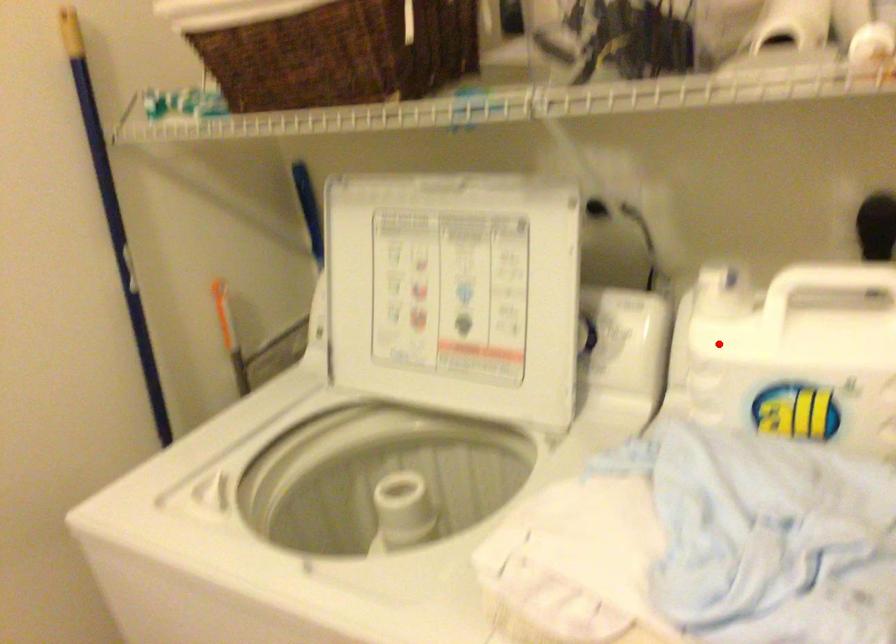
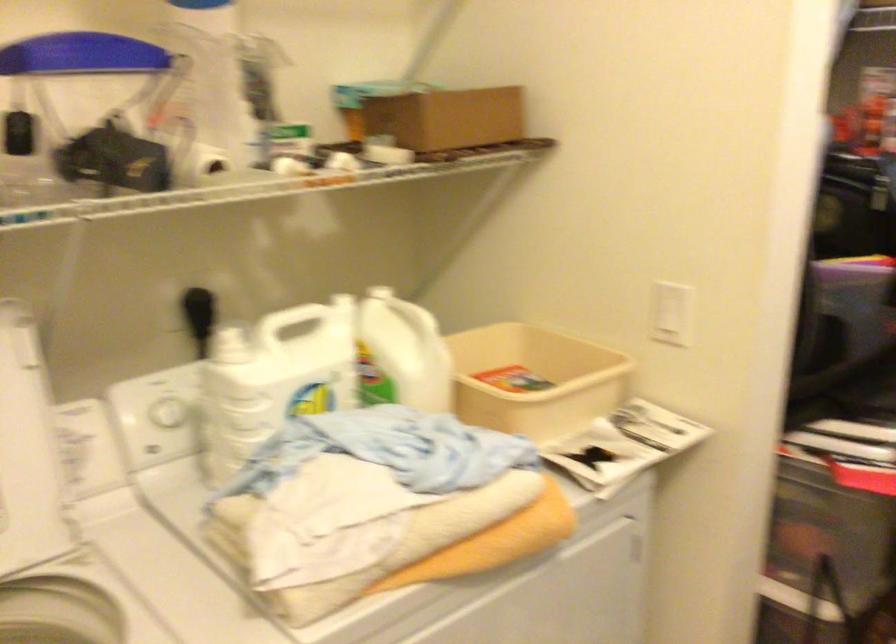
Question: I am providing you with two images of the same scene from different viewpoints. In image1, a red point is highlighted. Considering the same 3D point in image2, which of the following is correct?

Choices:
 (A) It is closer
 (B) It is farther

Answer: (B)